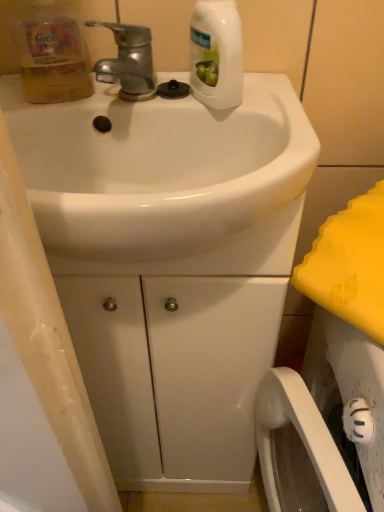
Question: Is white glossy bottle at upper center, which appears as the second cleaning product when viewed from the left, wider than translucent yellow bottle at upper left, the 1th cleaning product in the left-to-right sequence?

Choices:
 (A) yes
 (B) no

Answer: (A)

Question: Could translucent yellow bottle at upper left, the 1th cleaning product in the left-to-right sequence, be considered to be inside white glossy bottle at upper center, marked as the first cleaning product in a right-to-left arrangement?

Choices:
 (A) yes
 (B) no

Answer: (B)

Question: Is white glossy bottle at upper center, which appears as the second cleaning product when viewed from the left, taller than translucent yellow bottle at upper left, the 1th cleaning product in the left-to-right sequence?

Choices:
 (A) yes
 (B) no

Answer: (A)

Question: Is white glossy bottle at upper center, marked as the first cleaning product in a right-to-left arrangement, not inside translucent yellow bottle at upper left, the 2th cleaning product viewed from the right?

Choices:
 (A) yes
 (B) no

Answer: (A)

Question: Considering the relative positions of white glossy bottle at upper center, marked as the first cleaning product in a right-to-left arrangement, and translucent yellow bottle at upper left, the 1th cleaning product in the left-to-right sequence, in the image provided, is white glossy bottle at upper center, marked as the first cleaning product in a right-to-left arrangement, behind translucent yellow bottle at upper left, the 1th cleaning product in the left-to-right sequence,?

Choices:
 (A) yes
 (B) no

Answer: (B)

Question: From the image's perspective, is white glossy bottle at upper center, which appears as the second cleaning product when viewed from the left, above or below translucent yellow bottle at upper left, the 1th cleaning product in the left-to-right sequence?

Choices:
 (A) above
 (B) below

Answer: (A)

Question: In terms of height, does white glossy bottle at upper center, which appears as the second cleaning product when viewed from the left, look taller or shorter compared to translucent yellow bottle at upper left, the 1th cleaning product in the left-to-right sequence?

Choices:
 (A) tall
 (B) short

Answer: (A)

Question: From a real-world perspective, relative to translucent yellow bottle at upper left, the 1th cleaning product in the left-to-right sequence, is white glossy bottle at upper center, which appears as the second cleaning product when viewed from the left, vertically above or below?

Choices:
 (A) below
 (B) above

Answer: (B)

Question: Do you think white glossy bottle at upper center, marked as the first cleaning product in a right-to-left arrangement, is within translucent yellow bottle at upper left, the 2th cleaning product viewed from the right, or outside of it?

Choices:
 (A) inside
 (B) outside

Answer: (B)

Question: Looking at their shapes, would you say white glossy bottle at upper center, which appears as the second cleaning product when viewed from the left, is wider or thinner than shiny metallic faucet at upper left?

Choices:
 (A) wide
 (B) thin

Answer: (B)

Question: From the image's perspective, is white glossy bottle at upper center, which appears as the second cleaning product when viewed from the left, positioned above or below shiny metallic faucet at upper left?

Choices:
 (A) above
 (B) below

Answer: (A)

Question: Considering the positions of point (231, 25) and point (105, 67), is point (231, 25) closer or farther from the camera than point (105, 67)?

Choices:
 (A) closer
 (B) farther

Answer: (A)

Question: Visually, is white glossy bottle at upper center, marked as the first cleaning product in a right-to-left arrangement, positioned to the left or to the right of shiny metallic faucet at upper left?

Choices:
 (A) left
 (B) right

Answer: (B)

Question: Considering their positions, is white glossy bottle at upper center, marked as the first cleaning product in a right-to-left arrangement, located in front of or behind white glossy sink at center?

Choices:
 (A) behind
 (B) front

Answer: (A)

Question: From the image's perspective, is white glossy bottle at upper center, which appears as the second cleaning product when viewed from the left, located above or below white glossy sink at center?

Choices:
 (A) below
 (B) above

Answer: (B)